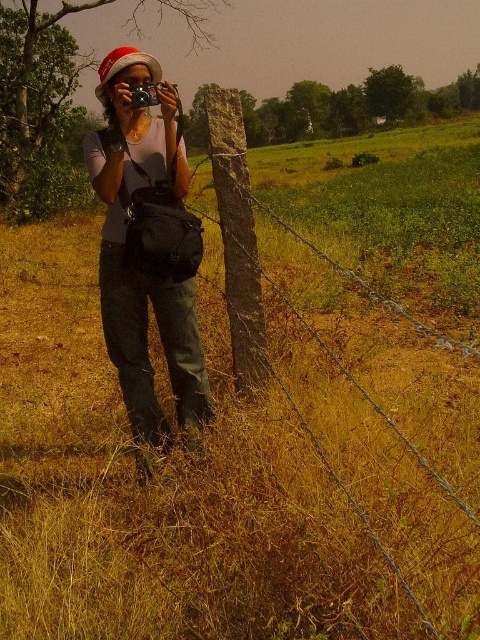
You are a photographer trying to position your matte black camera at center to capture the entire barbed wire fence and the trees in the background. Based on the camera position, will the fence and trees be in the frame?

The matte black camera at center is positioned at coordinates [146,248], which places it centrally in the scene. This position allows the camera to capture both the barbed wire fence in the foreground and the trees in the background within the frame.